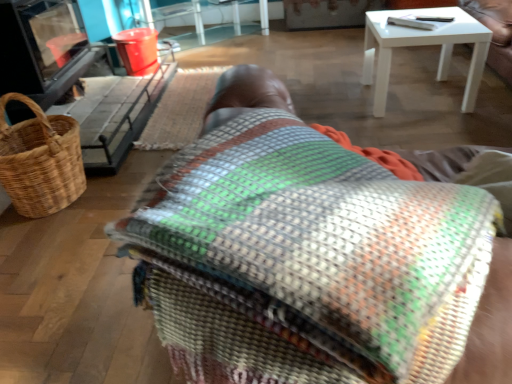
Question: Looking at their shapes, would you say translucent plastic table at upper center is wider or thinner than woven fabric mat at upper center?

Choices:
 (A) wide
 (B) thin

Answer: (A)

Question: Is translucent plastic table at upper center situated inside woven fabric mat at upper center or outside?

Choices:
 (A) inside
 (B) outside

Answer: (B)

Question: Estimate the real-world distances between objects in this image. Which object is farther from the multicolored woven blanket at center?

Choices:
 (A) translucent plastic table at upper center
 (B) woven fabric mat at upper center
 (C) brown woven picnic basket at left

Answer: (A)

Question: Which object is the closest to the brown woven picnic basket at left?

Choices:
 (A) woven fabric mat at upper center
 (B) multicolored woven blanket at center
 (C) translucent plastic table at upper center

Answer: (A)